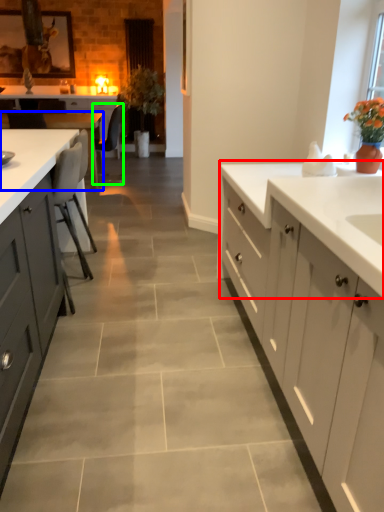
Question: Estimate the real-world distances between objects in this image. Which object is farther from countertop (highlighted by a red box), table (highlighted by a blue box) or chair (highlighted by a green box)?

Choices:
 (A) table
 (B) chair

Answer: (B)